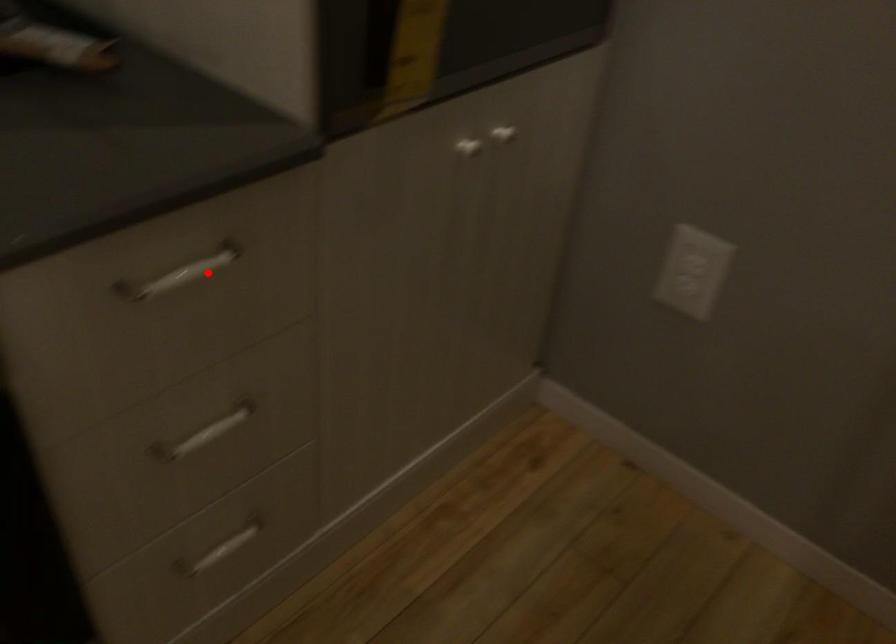
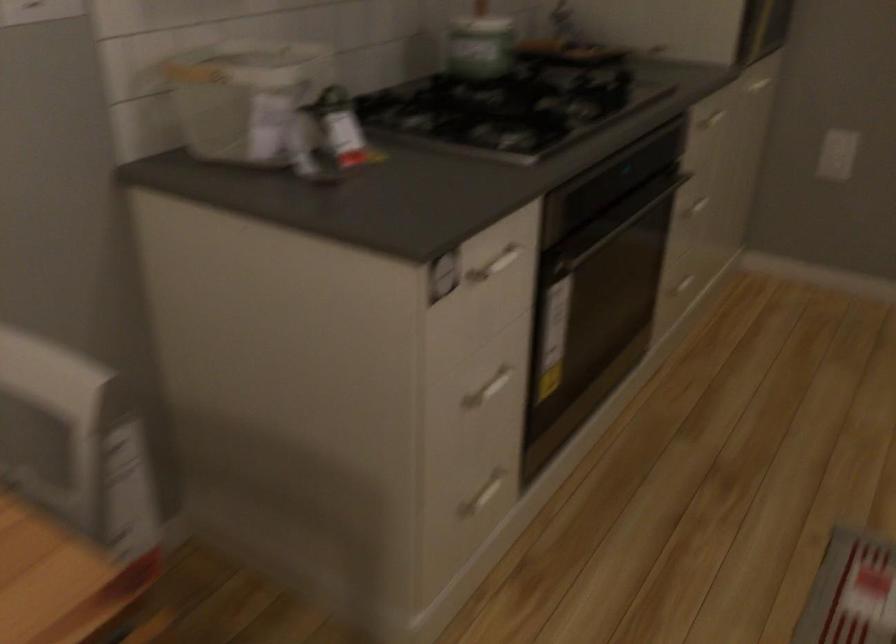
Question: I am providing you with two images of the same scene from different viewpoints. A red point is shown in image1. For the corresponding object point in image2, is it positioned nearer or farther from the camera?

Choices:
 (A) Nearer
 (B) Farther

Answer: (B)